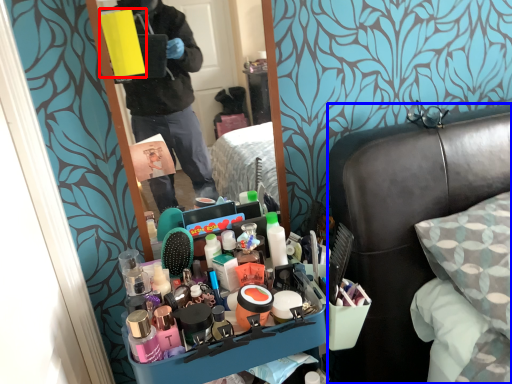
Question: Which object appears farthest to the camera in this image, box (highlighted by a red box) or furniture (highlighted by a blue box)?

Choices:
 (A) box
 (B) furniture

Answer: (A)